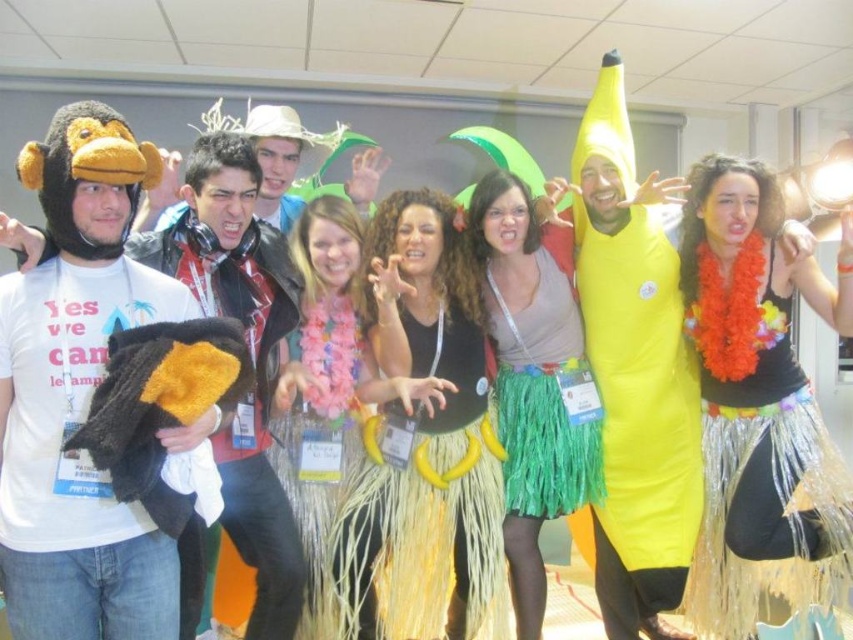
You are a photographer trying to capture a group photo of the green grass skirt at center and fluffy yellow skirt at center. Which of the two skirts should you focus on to ensure they are both fully visible in the photo?

The green grass skirt at center is not as tall as fluffy yellow skirt at center, so focusing on the fluffy yellow skirt at center will ensure both are fully visible since it is taller and can accommodate the shorter one within the frame.

You are a photographer taking pictures of the fuzzy black and yellow monkey at left and the yellow grass skirt at center. Which object should you focus on first if you want to capture both in the same frame without moving the camera?

You should focus on the fuzzy black and yellow monkey at left first because it is in front of the yellow grass skirt at center, so keeping it in focus will ensure both are visible in the frame.